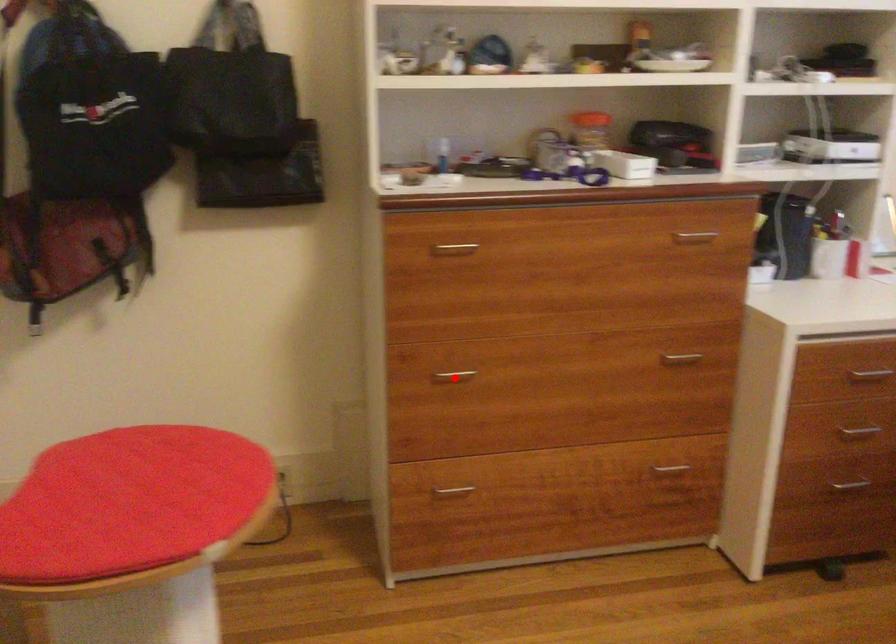
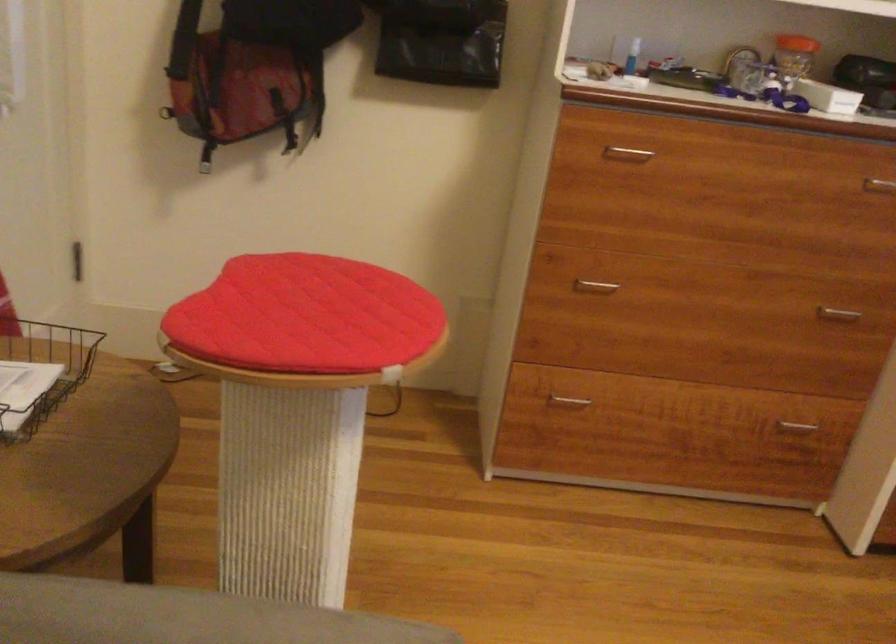
Find the pixel in the second image that matches the highlighted location in the first image.

(595, 286)